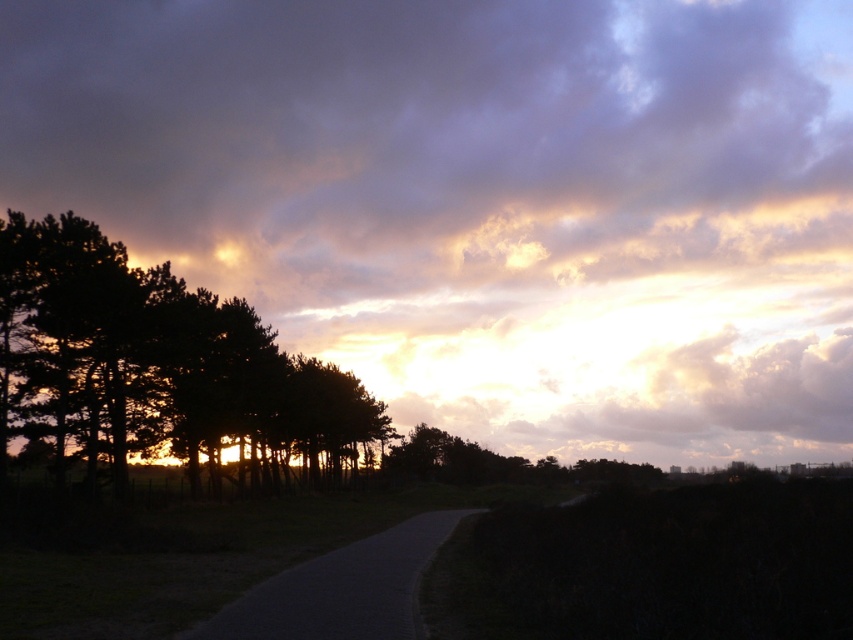
Question: Which point appears farthest from the camera in this image?

Choices:
 (A) (502, 218)
 (B) (415, 524)

Answer: (A)

Question: Which of the following is the closest to the observer?

Choices:
 (A) dark green foliage at left
 (B) dark asphalt road at center

Answer: (B)

Question: Among these objects, which one is nearest to the camera?

Choices:
 (A) cloudy sky at upper center
 (B) dark green foliage at left
 (C) dark asphalt road at center

Answer: (C)

Question: Is dark green foliage at left to the left of dark asphalt road at center from the viewer's perspective?

Choices:
 (A) yes
 (B) no

Answer: (A)

Question: Is dark green foliage at left to the right of dark asphalt road at center from the viewer's perspective?

Choices:
 (A) yes
 (B) no

Answer: (B)

Question: Is dark green foliage at left further to camera compared to dark asphalt road at center?

Choices:
 (A) yes
 (B) no

Answer: (A)